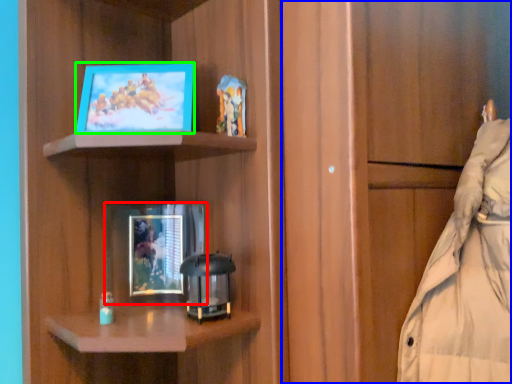
Question: Which is nearer to the picture frame (highlighted by a red box)? cabinetry (highlighted by a blue box) or picture frame (highlighted by a green box).

Choices:
 (A) cabinetry
 (B) picture frame

Answer: (B)